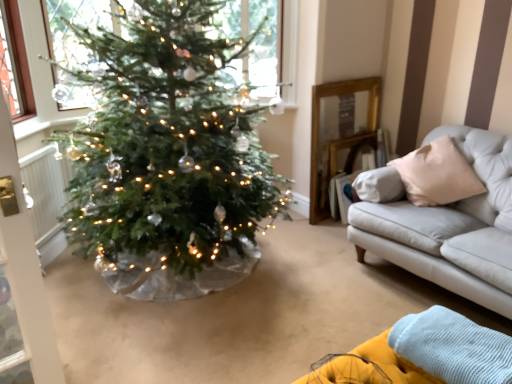
Measure the distance between point (270, 50) and camera.

The depth of point (270, 50) is 3.35 meters.

Locate an element on the screen. yellow fabric couch at lower right is located at coordinates (422, 354).

From the image's perspective, between white textured radiator at left and yellow fabric couch at lower right, which one is located above?

white textured radiator at left.

Who is shorter, white textured radiator at left or yellow fabric couch at lower right?

Standing shorter between the two is yellow fabric couch at lower right.

From a real-world perspective, is white textured radiator at left physically located above or below yellow fabric couch at lower right?

From a real-world perspective, white textured radiator at left is physically above yellow fabric couch at lower right.

Is white textured radiator at left in contact with yellow fabric couch at lower right?

No, white textured radiator at left is not beside yellow fabric couch at lower right.

Would you say clear glass window at upper center is a long distance from yellow fabric couch at lower right?

Yes.

Is clear glass window at upper center oriented towards yellow fabric couch at lower right?

Yes, clear glass window at upper center is aimed at yellow fabric couch at lower right.

Can you confirm if clear glass window at upper center is taller than yellow fabric couch at lower right?

Yes.

Considering the relative sizes of clear glass window at upper center and yellow fabric couch at lower right in the image provided, is clear glass window at upper center smaller than yellow fabric couch at lower right?

Yes, clear glass window at upper center is smaller than yellow fabric couch at lower right.

Is yellow fabric couch at lower right wider or thinner than clear glass window at upper center?

yellow fabric couch at lower right is wider than clear glass window at upper center.

Based on the photo, is yellow fabric couch at lower right positioned before clear glass window at upper center?

That is True.

Considering the sizes of objects yellow fabric couch at lower right and clear glass window at upper center in the image provided, who is bigger, yellow fabric couch at lower right or clear glass window at upper center?

yellow fabric couch at lower right is bigger.

Is yellow fabric couch at lower right looking in the opposite direction of clear glass window at upper center?

No.

Does clear glass window at upper center turn towards white textured radiator at left?

No, clear glass window at upper center is not oriented towards white textured radiator at left.

You are a GUI agent. You are given a task and a screenshot of the screen. Output one action in this format:
    pyautogui.click(x=<x>, y=<y>)
    Task: Click on the window above the white textured radiator at left (from the image's perspective)
    The width and height of the screenshot is (512, 384).
    Given the screenshot: What is the action you would take?
    pyautogui.click(x=255, y=43)

Measure the distance from clear glass window at upper center to white textured radiator at left.

clear glass window at upper center and white textured radiator at left are 1.52 meters apart.

Does clear glass window at upper center come in front of white textured radiator at left?

No, the depth of clear glass window at upper center is greater than that of white textured radiator at left.

Between yellow fabric couch at lower right and white textured radiator at left, which one has larger size?

yellow fabric couch at lower right.

Considering the positions of points (475, 373) and (46, 210), is point (475, 373) farther from camera compared to point (46, 210)?

No, it is not.

Would you say yellow fabric couch at lower right is to the left or to the right of white textured radiator at left in the picture?

In the image, yellow fabric couch at lower right appears on the right side of white textured radiator at left.

Are yellow fabric couch at lower right and white textured radiator at left far apart?

yellow fabric couch at lower right is positioned a significant distance from white textured radiator at left.

Considering the relative sizes of white textured radiator at left and clear glass window at upper center in the image provided, is white textured radiator at left shorter than clear glass window at upper center?

Correct, white textured radiator at left is not as tall as clear glass window at upper center.

Measure the distance from white textured radiator at left to clear glass window at upper center.

white textured radiator at left and clear glass window at upper center are 1.52 meters apart from each other.

Consider the image. Considering the sizes of white textured radiator at left and clear glass window at upper center in the image, is white textured radiator at left wider or thinner than clear glass window at upper center?

white textured radiator at left is thinner than clear glass window at upper center.

Is white textured radiator at left with clear glass window at upper center?

No.

This screenshot has width=512, height=384. In order to click on couch below the white textured radiator at left (from a real-world perspective) in this screenshot , I will do `click(422, 354)`.

Where is `window above the yellow fabric couch at lower right (from the image's perspective)`? window above the yellow fabric couch at lower right (from the image's perspective) is located at coordinates (255, 43).

Considering their positions, is white textured radiator at left positioned further to clear glass window at upper center than yellow fabric couch at lower right?

The object further to clear glass window at upper center is yellow fabric couch at lower right.

Looking at the image, which one is located further to white textured radiator at left, clear glass window at upper center or yellow fabric couch at lower right?

yellow fabric couch at lower right is positioned further to the anchor white textured radiator at left.

Looking at the image, which one is located closer to white textured radiator at left, yellow fabric couch at lower right or clear glass window at upper center?

clear glass window at upper center.

Considering their positions, is clear glass window at upper center positioned closer to yellow fabric couch at lower right than white textured radiator at left?

clear glass window at upper center is closer to yellow fabric couch at lower right.

Considering their positions, is yellow fabric couch at lower right positioned closer to clear glass window at upper center than white textured radiator at left?

white textured radiator at left is closer to clear glass window at upper center.

Looking at the image, which one is located further to yellow fabric couch at lower right, white textured radiator at left or clear glass window at upper center?

Based on the image, white textured radiator at left appears to be further to yellow fabric couch at lower right.

Locate an element on the screen. radiator between clear glass window at upper center and yellow fabric couch at lower right vertically is located at coordinates (46, 189).